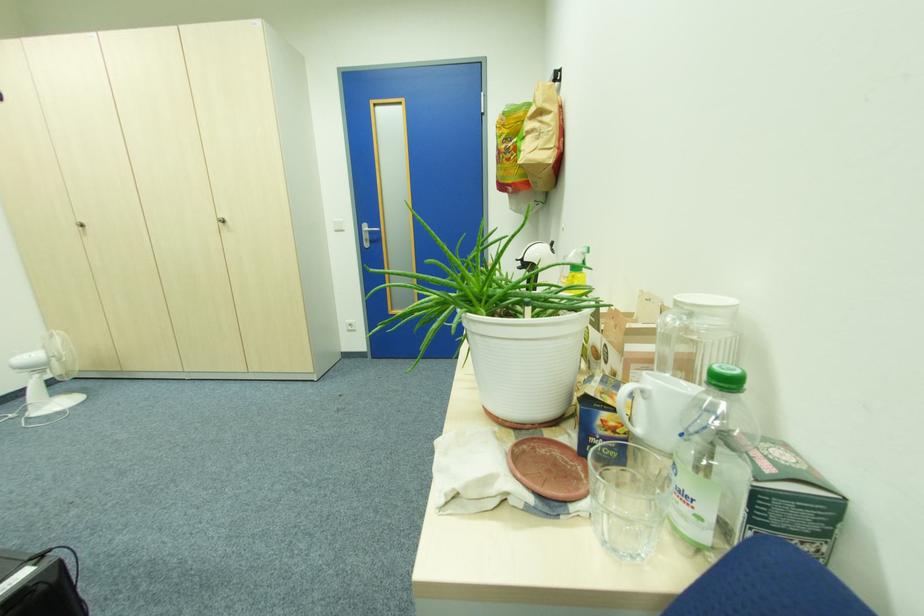
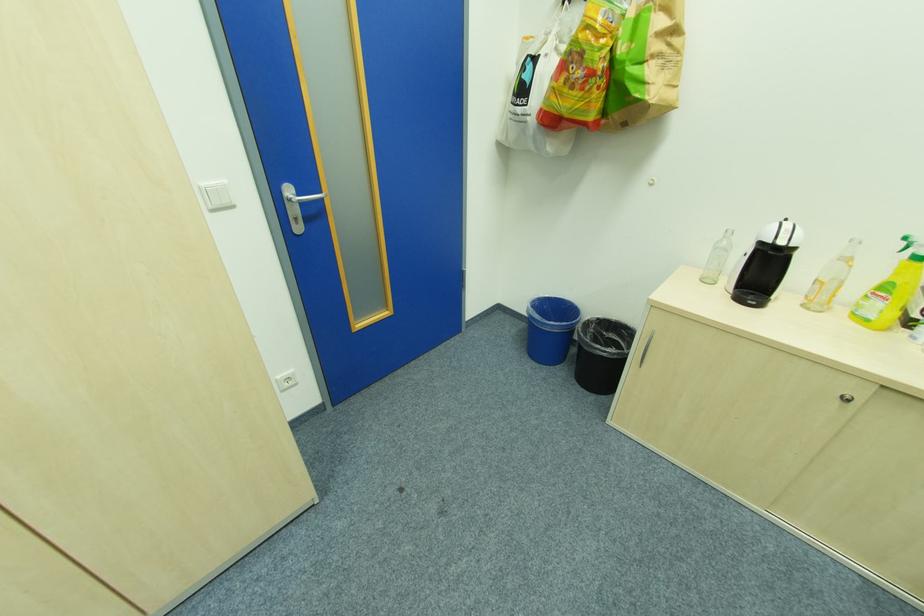
Find the pixel in the second image that matches (x=345, y=230) in the first image.

(232, 204)